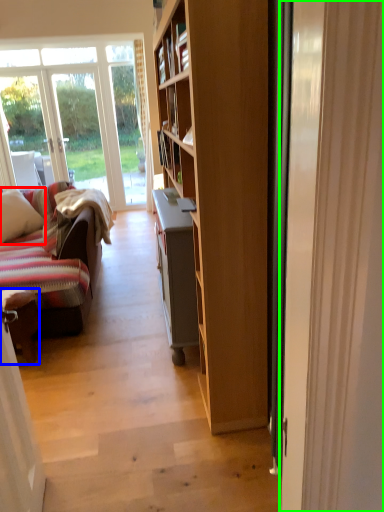
Question: Which object is positioned closest to pillow (highlighted by a red box)? Select from chair (highlighted by a blue box) and door (highlighted by a green box).

Choices:
 (A) chair
 (B) door

Answer: (A)